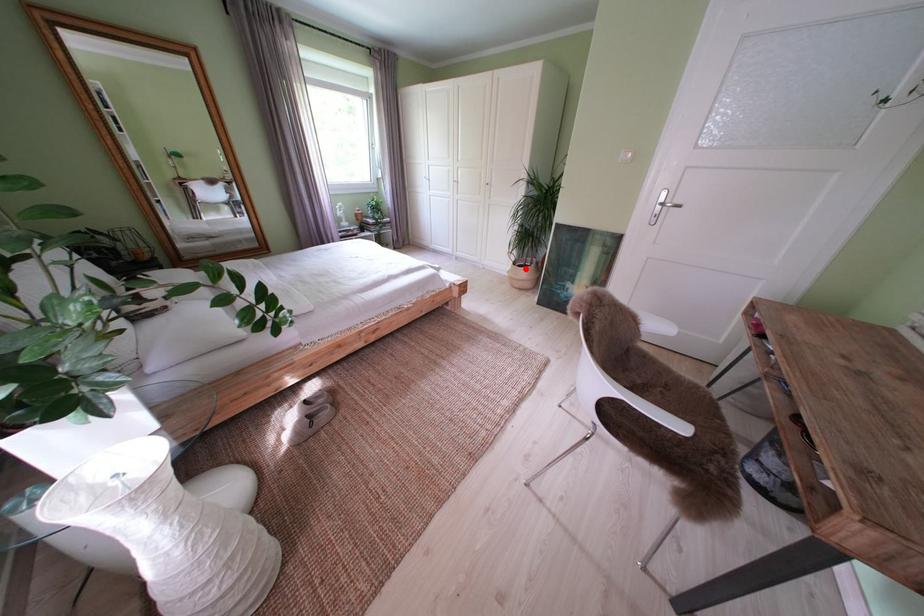
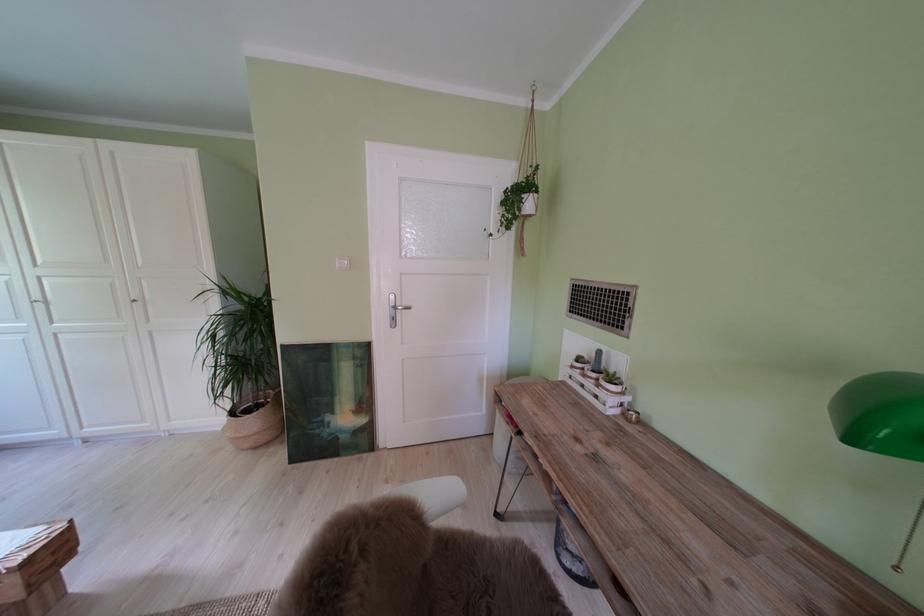
Question: I am providing you with two images of the same scene from different viewpoints. Image1 has a red point marked. In image2, the corresponding 3D location appears at what relative position? Reply with the corresponding letter.

Choices:
 (A) Closer
 (B) Farther

Answer: (B)